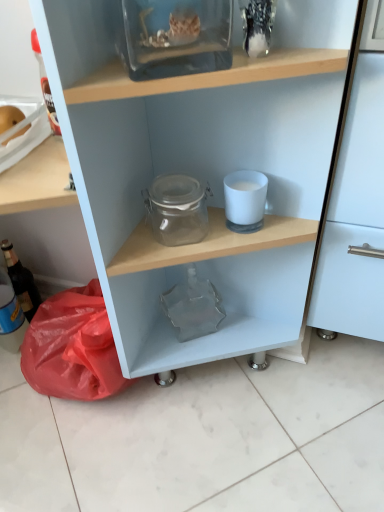
Question: Can you confirm if transparent glass jar at upper center is taller than matte glass bottle at left?

Choices:
 (A) yes
 (B) no

Answer: (B)

Question: Considering the relative sizes of transparent glass jar at upper center and matte glass bottle at left in the image provided, is transparent glass jar at upper center wider than matte glass bottle at left?

Choices:
 (A) yes
 (B) no

Answer: (A)

Question: From the image's perspective, is transparent glass jar at upper center located beneath matte glass bottle at left?

Choices:
 (A) no
 (B) yes

Answer: (A)

Question: Does transparent glass jar at upper center turn towards matte glass bottle at left?

Choices:
 (A) no
 (B) yes

Answer: (A)

Question: Does transparent glass jar at upper center come behind matte glass bottle at left?

Choices:
 (A) yes
 (B) no

Answer: (B)

Question: Do you think matte glass bottle at left is within transparent glass jar at center, or outside of it?

Choices:
 (A) inside
 (B) outside

Answer: (A)

Question: From a real-world perspective, relative to transparent glass jar at center, is matte glass bottle at left vertically above or below?

Choices:
 (A) above
 (B) below

Answer: (B)

Question: From the image's perspective, is matte glass bottle at left above or below transparent glass jar at center?

Choices:
 (A) below
 (B) above

Answer: (A)

Question: Based on their positions, is matte glass bottle at left located to the left or right of transparent glass jar at center?

Choices:
 (A) right
 (B) left

Answer: (B)

Question: Do you think transparent glass jar at upper center is within transparent glass jar at center, or outside of it?

Choices:
 (A) inside
 (B) outside

Answer: (B)

Question: Is transparent glass jar at upper center bigger or smaller than transparent glass jar at center?

Choices:
 (A) big
 (B) small

Answer: (A)

Question: In the image, is transparent glass jar at upper center on the left side or the right side of transparent glass jar at center?

Choices:
 (A) left
 (B) right

Answer: (B)

Question: From a real-world perspective, is transparent glass jar at upper center above or below transparent glass jar at center?

Choices:
 (A) below
 (B) above

Answer: (B)

Question: Would you say transparent glass jar at center is to the left or to the right of matte glass bottle at left in the picture?

Choices:
 (A) left
 (B) right

Answer: (B)

Question: Does point (198, 93) appear closer or farther from the camera than point (3, 248)?

Choices:
 (A) farther
 (B) closer

Answer: (B)